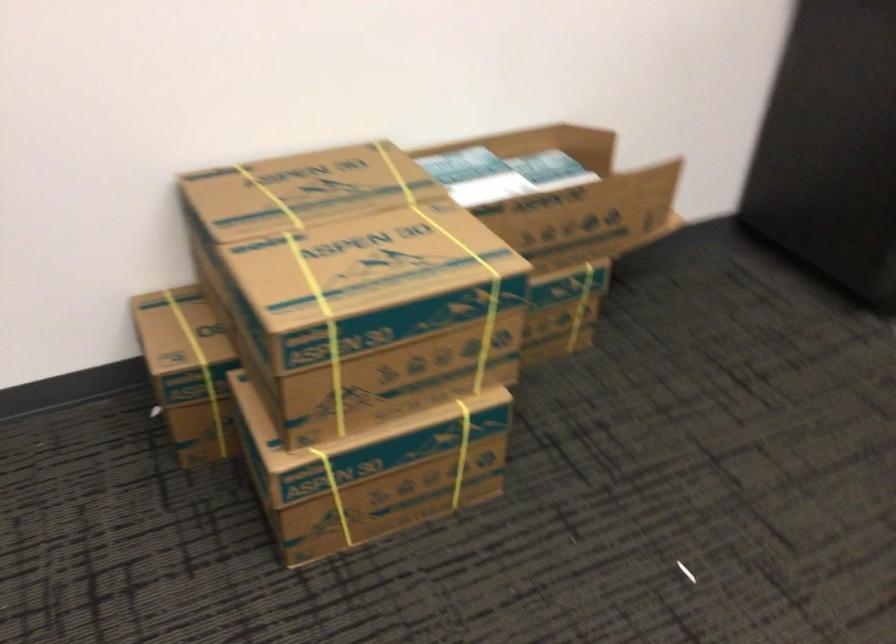
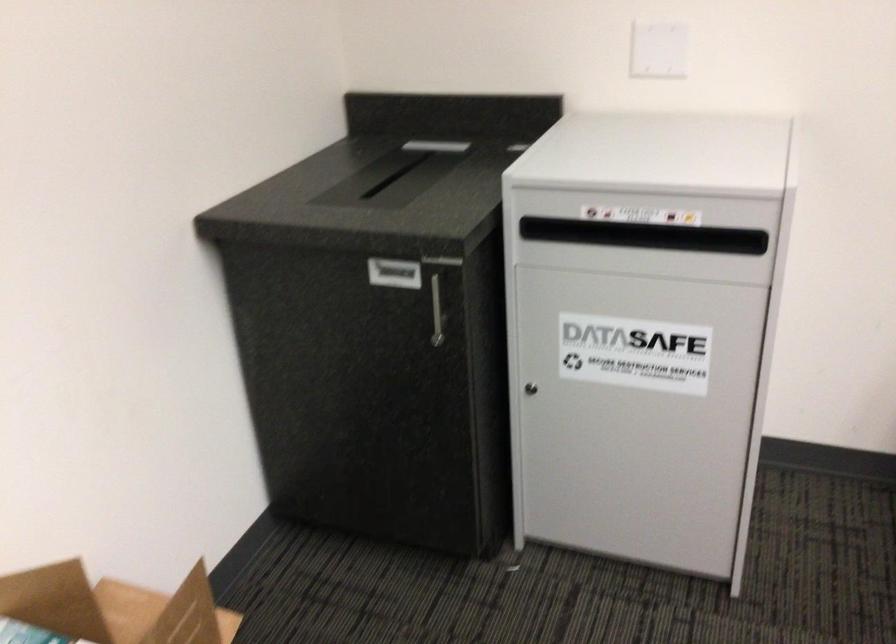
Question: The images are taken continuously from a first-person perspective. In which direction is your viewpoint rotating?

Choices:
 (A) Left
 (B) Right
 (C) Up
 (D) Down

Answer: (B)